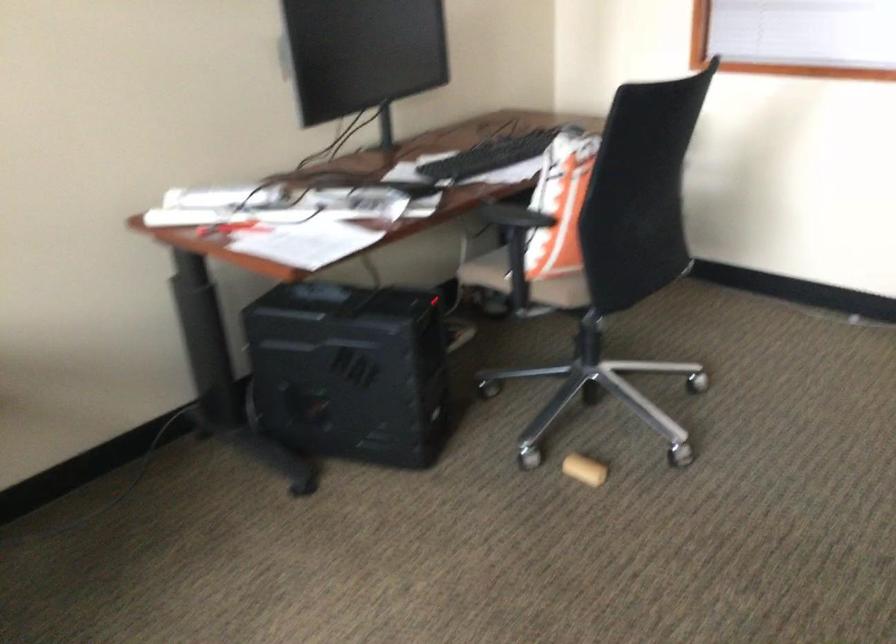
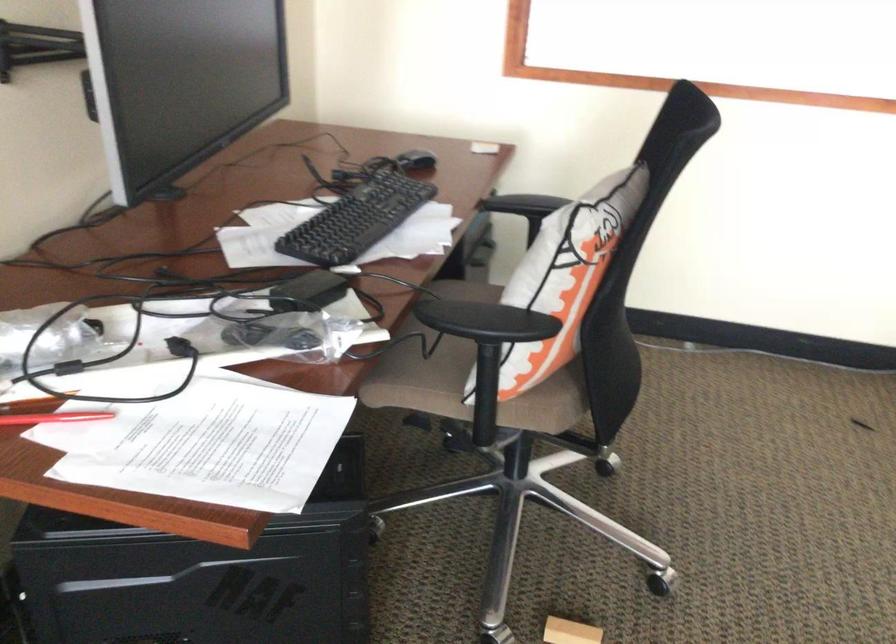
The point at (552, 185) is marked in the first image. Where is the corresponding point in the second image?

(564, 277)